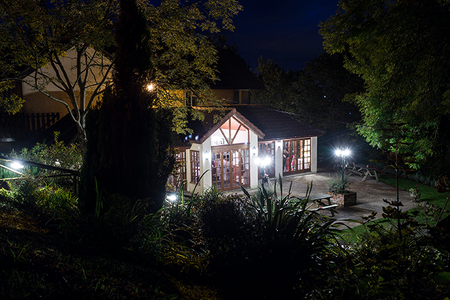
Where is `windows on the bottom floor`? windows on the bottom floor is located at coordinates (292, 159), (304, 157), (193, 164), (179, 166), (235, 177).